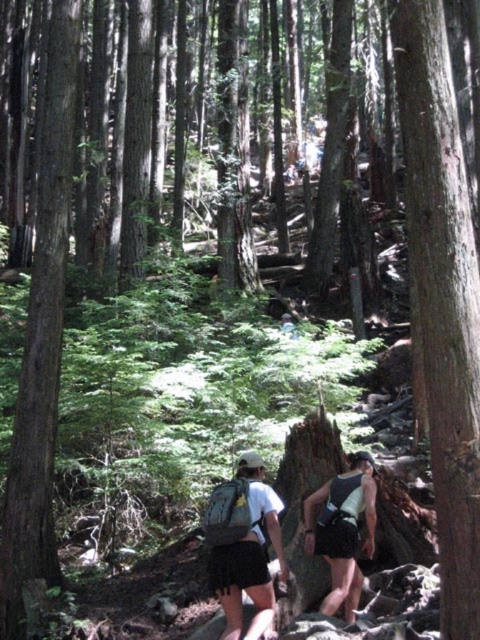
Question: Which object is the farthest from the black mesh backpack at center?

Choices:
 (A) matte green backpack at center
 (B) white cotton t-shirt at center

Answer: (A)

Question: Is white cotton t-shirt at center to the left of black mesh backpack at center from the viewer's perspective?

Choices:
 (A) no
 (B) yes

Answer: (B)

Question: Can you confirm if white cotton t-shirt at center is smaller than matte green backpack at center?

Choices:
 (A) no
 (B) yes

Answer: (A)

Question: Among these objects, which one is nearest to the camera?

Choices:
 (A) white cotton t-shirt at center
 (B) matte green backpack at center

Answer: (B)

Question: Which of these objects is positioned closest to the white cotton t-shirt at center?

Choices:
 (A) black mesh backpack at center
 (B) matte green backpack at center

Answer: (A)

Question: Can you confirm if matte green backpack at center is wider than black mesh backpack at center?

Choices:
 (A) no
 (B) yes

Answer: (A)